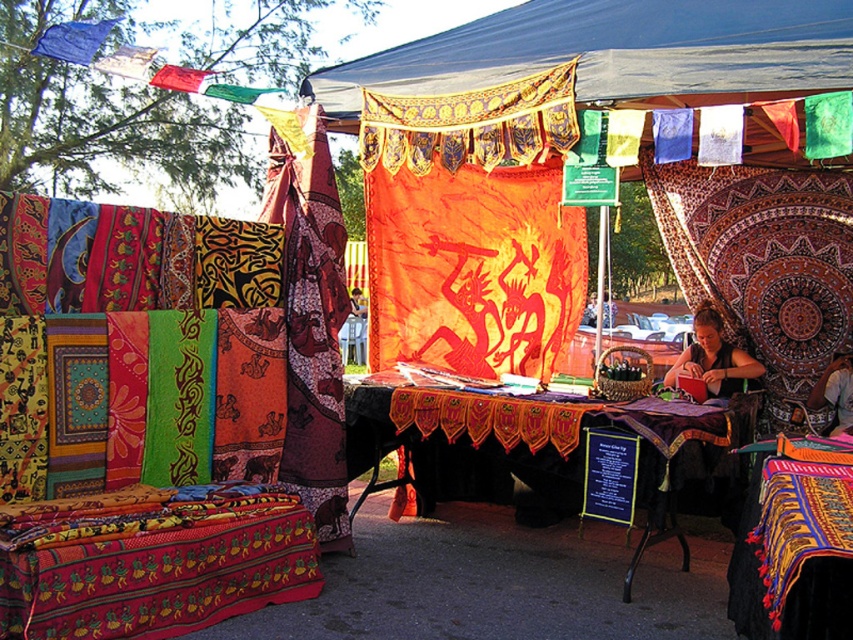
Question: Does multicolored woven cloth at center have a larger size compared to matte black fabric at center?

Choices:
 (A) no
 (B) yes

Answer: (B)

Question: Is matte black table at center further to the viewer compared to matte black fabric at center?

Choices:
 (A) yes
 (B) no

Answer: (B)

Question: Which of the following is the closest to the observer?

Choices:
 (A) (735, 548)
 (B) (610, 26)
 (C) (215, 579)
 (D) (709, 372)

Answer: (C)

Question: Among these objects, which one is farthest from the camera?

Choices:
 (A) multicolored woven cloth at center
 (B) matte black table at center
 (C) vibrant woven quilt at lower left
 (D) matte black fabric at center

Answer: (D)

Question: Based on their relative distances, which object is farther from the vibrant woven quilt at lower left?

Choices:
 (A) matte black table at center
 (B) multicolored woven cloth at center
 (C) matte black fabric at center
 (D) orange fabric canopy at center

Answer: (C)

Question: Is multicolored woven cloth at center wider than matte black fabric at center?

Choices:
 (A) no
 (B) yes

Answer: (B)